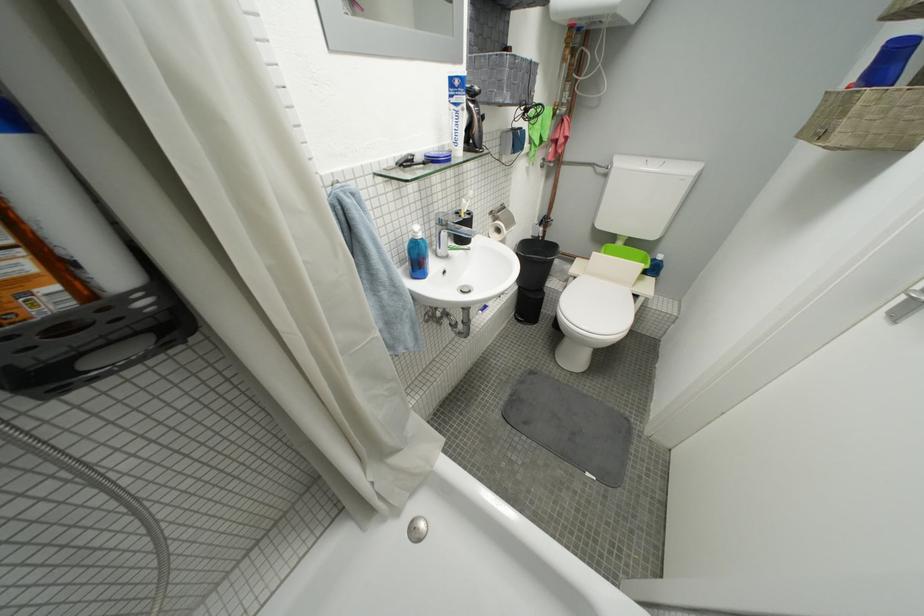
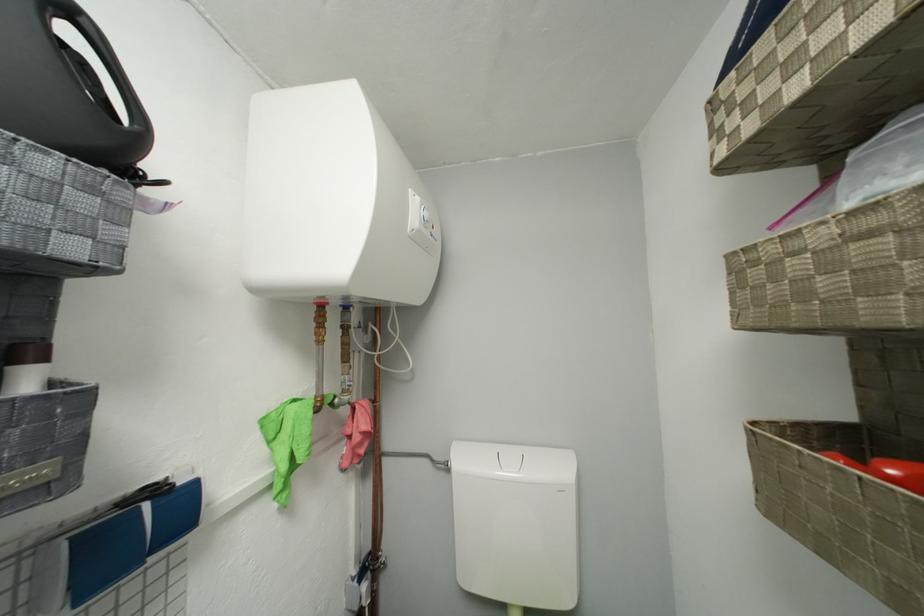
Locate, in the second image, the point that corresponds to the point at 565,139 in the first image.

(358, 435)